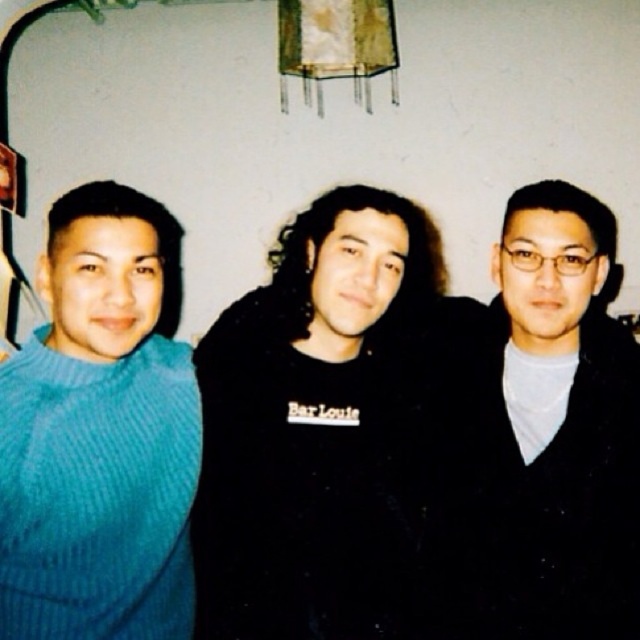
You are standing in the room and want to reach both the point at (465, 545) and the point at (131, 596). Which point is closer to you?

The point at (131, 596) is closer to you because it is less further to the viewer than the point at (465, 545).

You are organizing a clothing display and need to arrange the black matte shirt at center and the black matte sweater at center according to their positions in the image. Which one should be placed to the left of the other?

The black matte shirt at center is positioned on the left side of the black matte sweater at center, so the shirt should be placed to the left of the sweater.

You are taking a photo of the three people in the scene. You want to focus on the person closest to the camera. Which of the two points, point (289, 502) or point (58, 451), should you use as a reference for focusing?

Point (289, 502) is further to the camera than point (58, 451), so you should use point (289, 502) as the reference for focusing on the person closest to the camera.